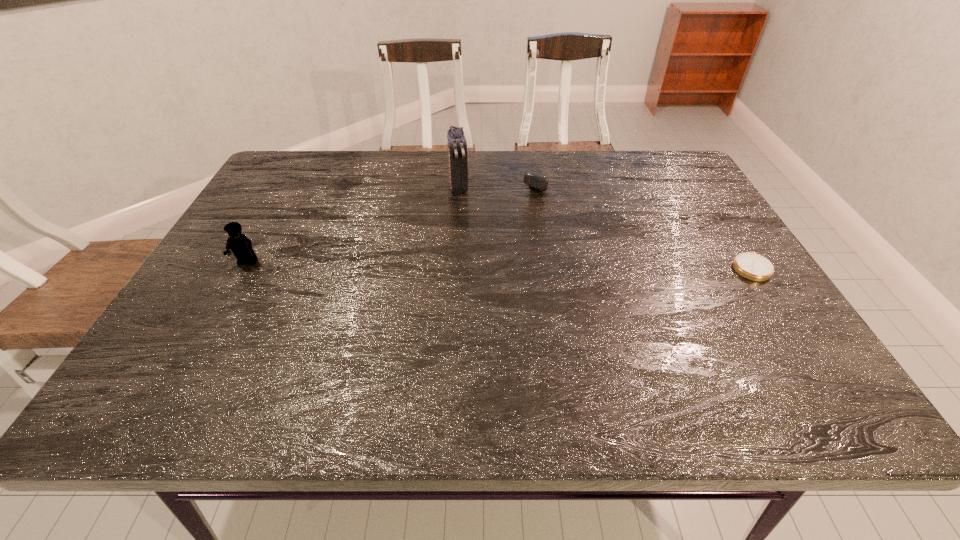
This screenshot has height=540, width=960. What are the coordinates of `free space on the desktop that is between the Lego and the rightmost object and is positioned on the front-facing side of the second shortest object` in the screenshot? It's located at (464, 264).

Identify the location of free space on the desktop that is between the third shortest object and the shortest object and is positioned with the zip open on the third object from right to left. The width and height of the screenshot is (960, 540). (473, 264).